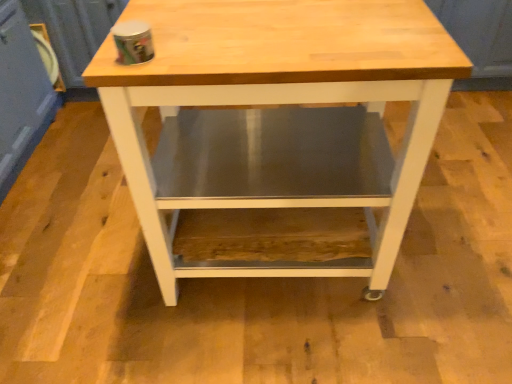
This screenshot has height=384, width=512. What do you see at coordinates (278, 121) in the screenshot? I see `natural wood table at center` at bounding box center [278, 121].

The image size is (512, 384). I want to click on natural wood table at center, so click(x=278, y=121).

Locate an element on the screen. Image resolution: width=512 pixels, height=384 pixels. natural wood table at center is located at coordinates (278, 121).